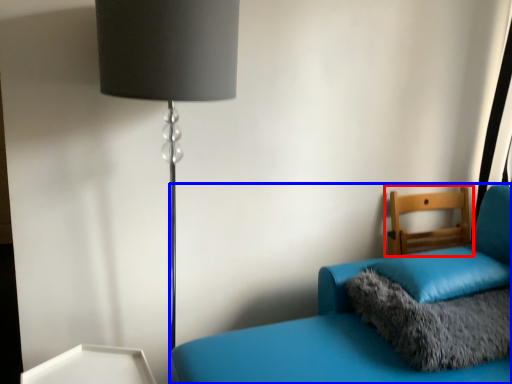
Question: Among these objects, which one is nearest to the camera, furniture (highlighted by a red box) or furniture (highlighted by a blue box)?

Choices:
 (A) furniture
 (B) furniture

Answer: (B)